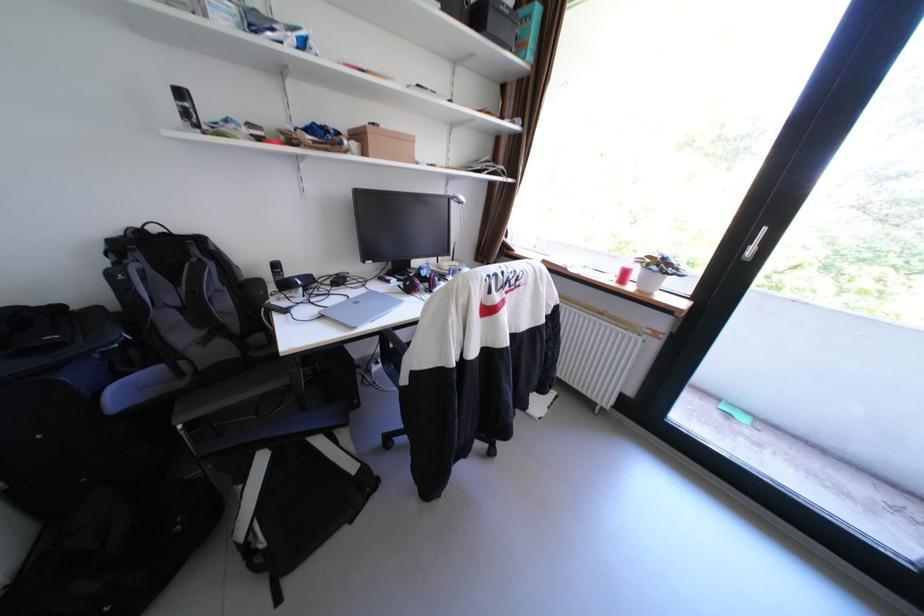
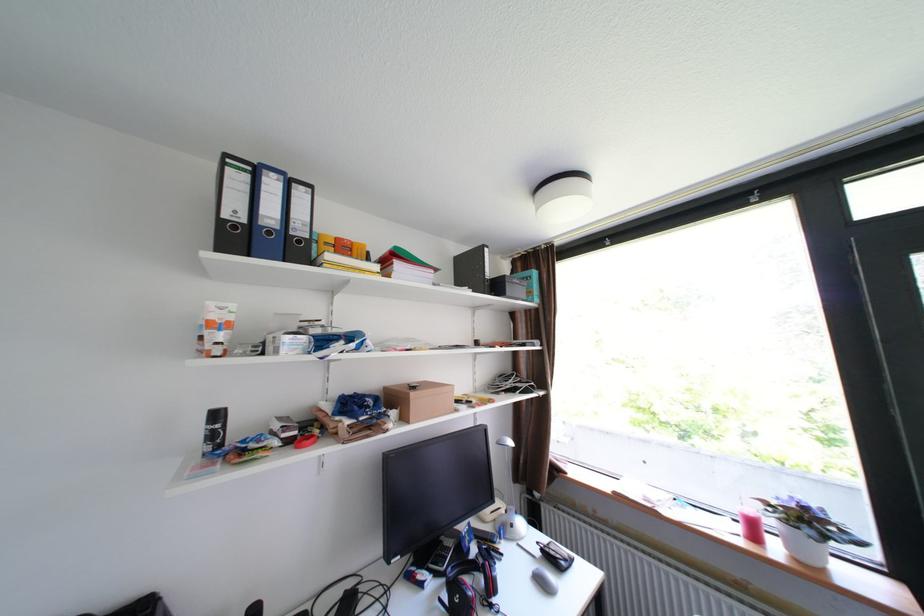
The point at (199, 116) is marked in the first image. Where is the corresponding point in the second image?

(225, 436)